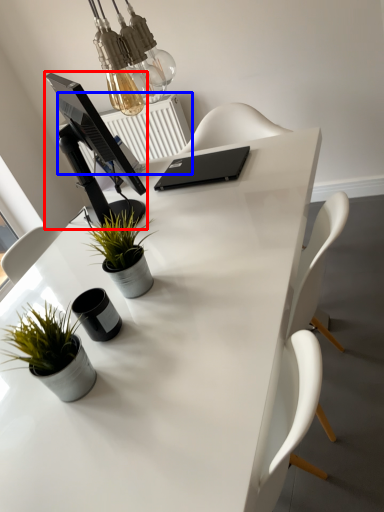
Question: Which point is further to the camera, computer monitor (highlighted by a red box) or radiator (highlighted by a blue box)?

Choices:
 (A) computer monitor
 (B) radiator

Answer: (B)